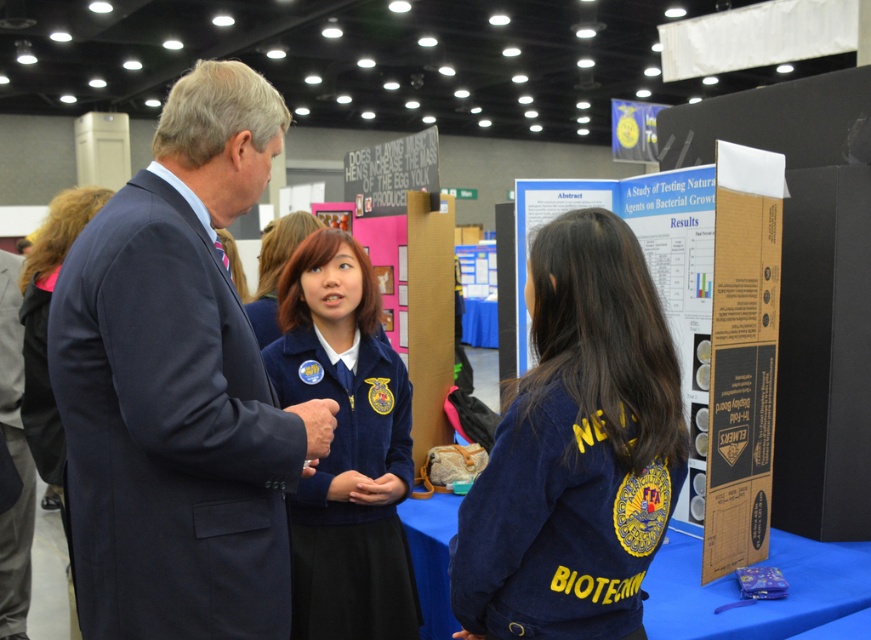
Question: Which object is farther from the camera taking this photo?

Choices:
 (A) blue velvety jacket at center
 (B) navy blue suit at left
 (C) dark blue uniform at center
 (D) navy blue jacket at center

Answer: (C)

Question: Is blue velvety jacket at center above matte blue uniform at center?

Choices:
 (A) no
 (B) yes

Answer: (A)

Question: Considering the real-world distances, which object is closest to the dark blue uniform at center?

Choices:
 (A) matte blue uniform at center
 (B) navy blue suit at left

Answer: (A)

Question: Does navy blue jacket at center appear over matte blue uniform at center?

Choices:
 (A) yes
 (B) no

Answer: (B)

Question: Does navy blue suit at left appear over blue velvety jacket at center?

Choices:
 (A) yes
 (B) no

Answer: (A)

Question: Which object is farther from the camera taking this photo?

Choices:
 (A) matte blue uniform at center
 (B) blue velvety jacket at center

Answer: (A)